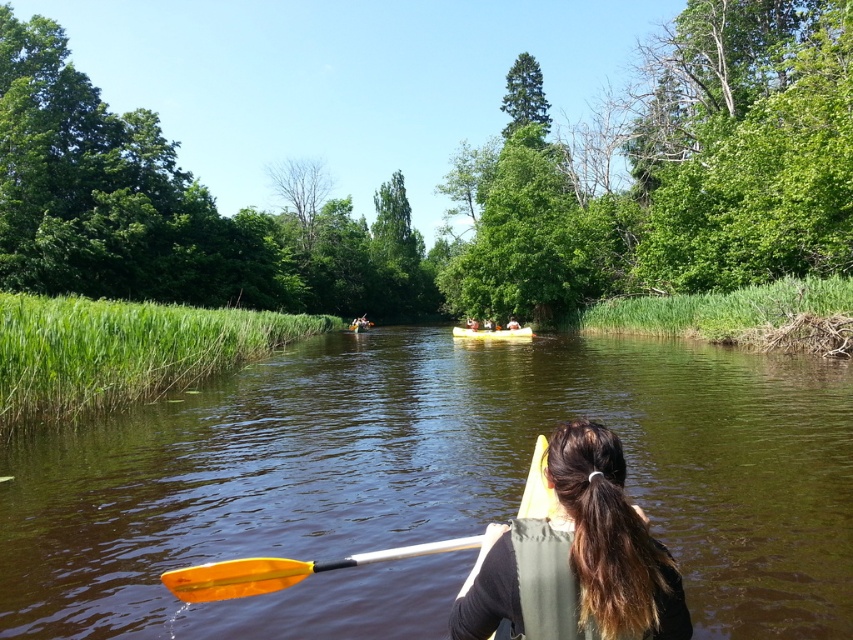
Is brown smooth water at center closer to camera compared to orange plastic paddle at lower center?

No, it is not.

Where is `brown smooth water at center`? brown smooth water at center is located at coordinates (430, 484).

Locate an element on the screen. The height and width of the screenshot is (640, 853). brown smooth water at center is located at coordinates (430, 484).

This screenshot has height=640, width=853. I want to click on dark brown hair at center, so click(x=610, y=545).

Between dark brown hair at center and wooden canoe at center, which one is positioned higher?

wooden canoe at center

Is point (653, 563) behind point (519, 333)?

No, it is in front of (519, 333).

Where is `dark brown hair at center`? The height and width of the screenshot is (640, 853). dark brown hair at center is located at coordinates (610, 545).

Does dark brown hair at center have a lesser width compared to orange plastic paddle at lower center?

Yes.

Does dark brown hair at center appear under orange plastic paddle at lower center?

No.

Consider the image. Measure the distance between dark brown hair at center and camera.

dark brown hair at center and camera are 11.87 feet apart.

Locate an element on the screen. dark brown hair at center is located at coordinates (610, 545).